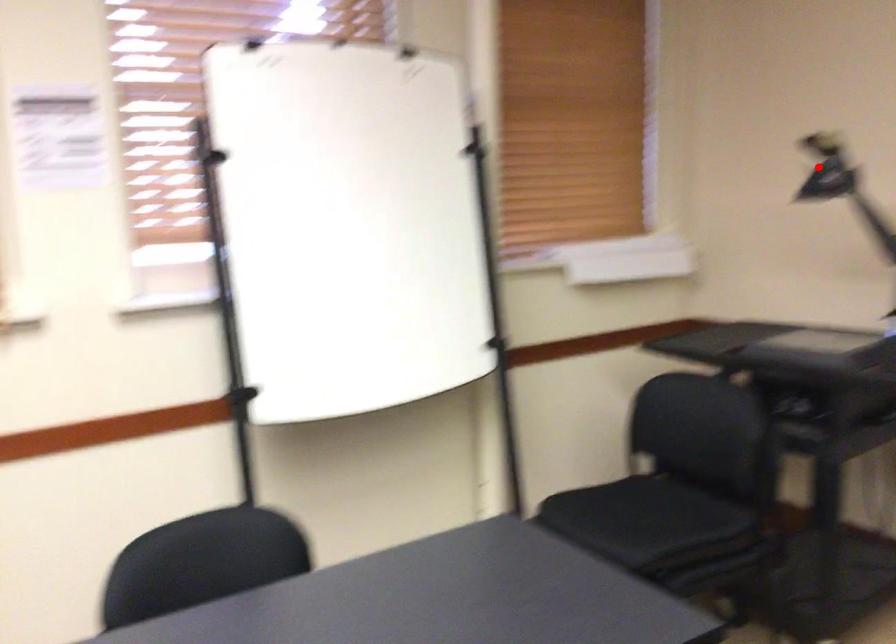
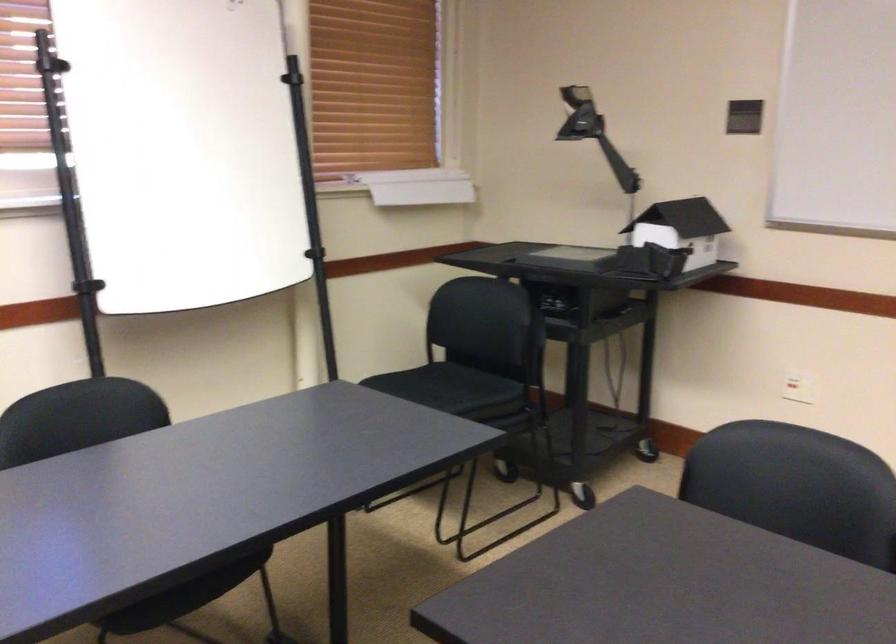
Question: I am providing you with two images of the same scene from different viewpoints. In image1, a red point is highlighted. Considering the same 3D point in image2, which of the following is correct?

Choices:
 (A) It is closer
 (B) It is farther

Answer: (B)